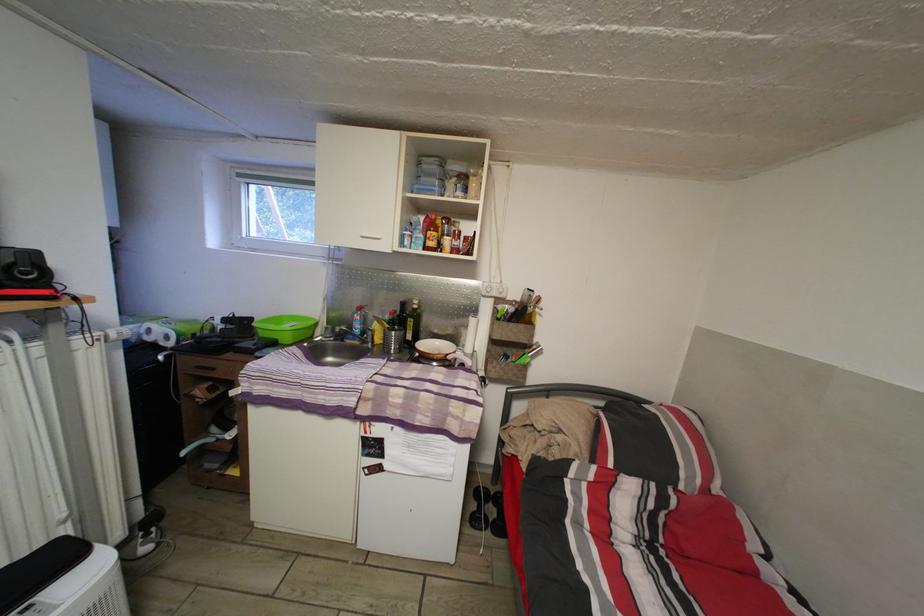
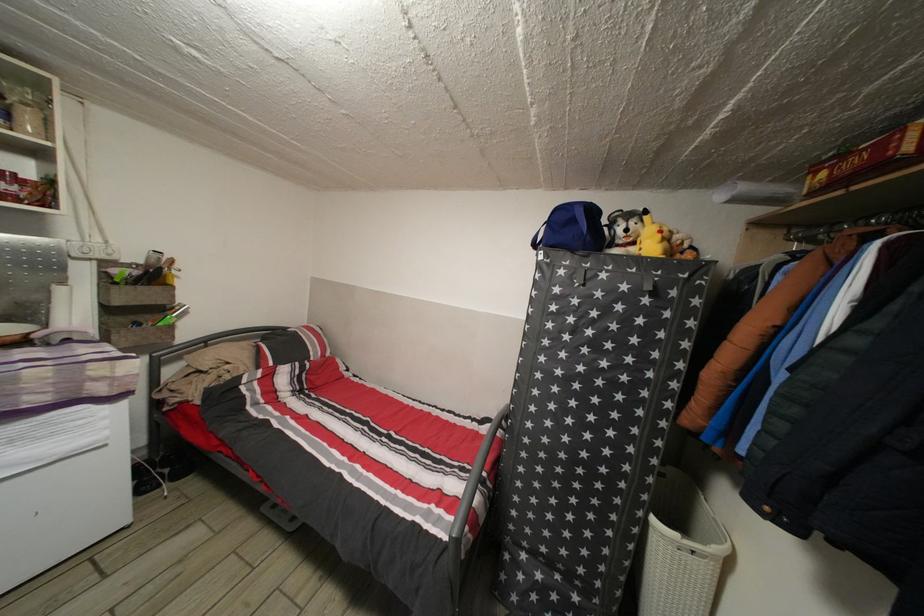
Question: Based on the continuous images, in which direction is the camera rotating? Reply with the corresponding letter.

Choices:
 (A) Left
 (B) Right
 (C) Up
 (D) Down

Answer: (B)